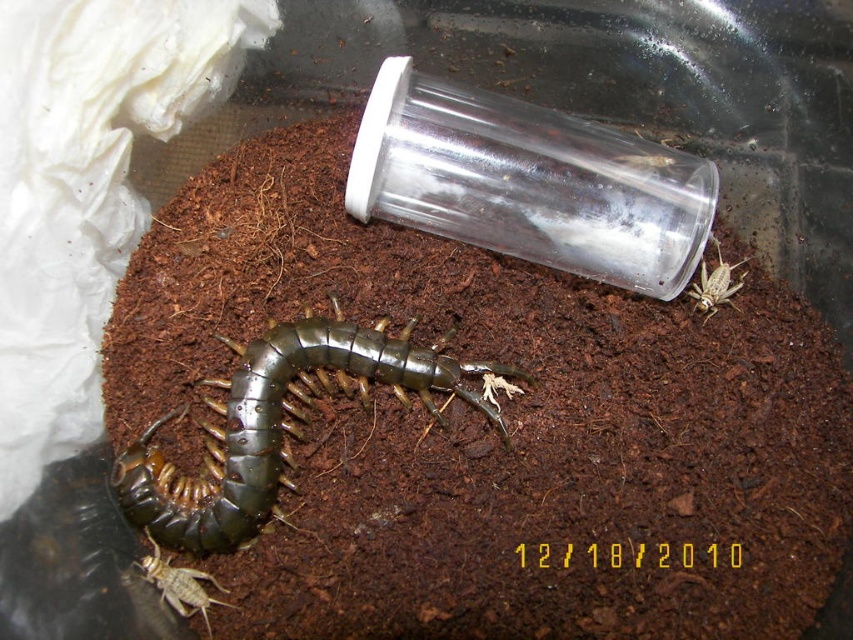
Question: Which is farther from the brown soil at center?

Choices:
 (A) shiny metallic centipede at center
 (B) translucent brown cricket at lower left
 (C) brown textured cricket at right

Answer: (B)

Question: Which object is the farthest from the shiny metallic centipede at center?

Choices:
 (A) brown textured cricket at right
 (B) translucent brown cricket at lower left

Answer: (A)

Question: Is brown soil at center closer to camera compared to shiny metallic centipede at center?

Choices:
 (A) yes
 (B) no

Answer: (B)

Question: Can you confirm if shiny metallic centipede at center is smaller than brown textured cricket at right?

Choices:
 (A) yes
 (B) no

Answer: (B)

Question: Can you confirm if brown soil at center is bigger than brown textured cricket at right?

Choices:
 (A) no
 (B) yes

Answer: (B)

Question: Which of the following is the closest to the observer?

Choices:
 (A) (200, 589)
 (B) (708, 312)

Answer: (A)